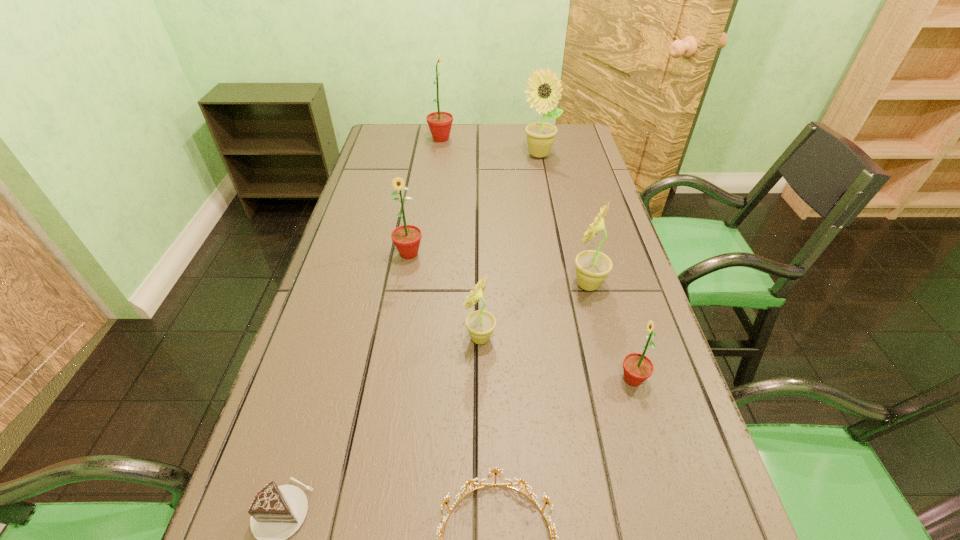
Locate an element on the screen. This screenshot has height=540, width=960. unoccupied area between the smallest green sunflower and the fourth nearest sunflower is located at coordinates (521, 316).

Where is `object that stands as the sixth closest to the farthest green sunflower`? The height and width of the screenshot is (540, 960). object that stands as the sixth closest to the farthest green sunflower is located at coordinates (471, 481).

Choose which object is the sixth nearest neighbor to the seventh nearest object. Please provide its 2D coordinates. Your answer should be formatted as a tuple, i.e. [(x, y)], where the tuple contains the x and y coordinates of a point satisfying the conditions above.

[(471, 481)]

I want to click on sunflower that stands as the closest to the smallest green sunflower, so click(592, 267).

Choose which sunflower is the second nearest neighbor to the nearest green sunflower. Please provide its 2D coordinates. Your answer should be formatted as a tuple, i.e. [(x, y)], where the tuple contains the x and y coordinates of a point satisfying the conditions above.

[(480, 324)]

Select which green sunflower is the closest to the biggest yellow sunflower. Please provide its 2D coordinates. Your answer should be formatted as a tuple, i.e. [(x, y)], where the tuple contains the x and y coordinates of a point satisfying the conditions above.

[(440, 123)]

Select which green sunflower appears as the third closest to the seventh nearest object. Please provide its 2D coordinates. Your answer should be formatted as a tuple, i.e. [(x, y)], where the tuple contains the x and y coordinates of a point satisfying the conditions above.

[(637, 367)]

Locate an element on the screen. The image size is (960, 540). the second closest yellow sunflower to the fourth sunflower from right to left is located at coordinates (544, 89).

Choose which yellow sunflower is the second nearest neighbor to the nearest sunflower. Please provide its 2D coordinates. Your answer should be formatted as a tuple, i.e. [(x, y)], where the tuple contains the x and y coordinates of a point satisfying the conditions above.

[(480, 324)]